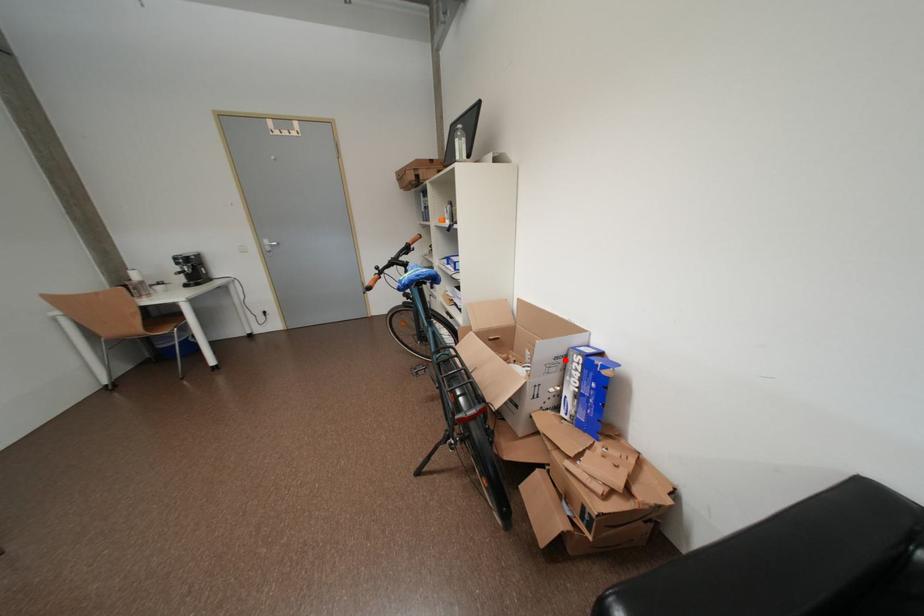
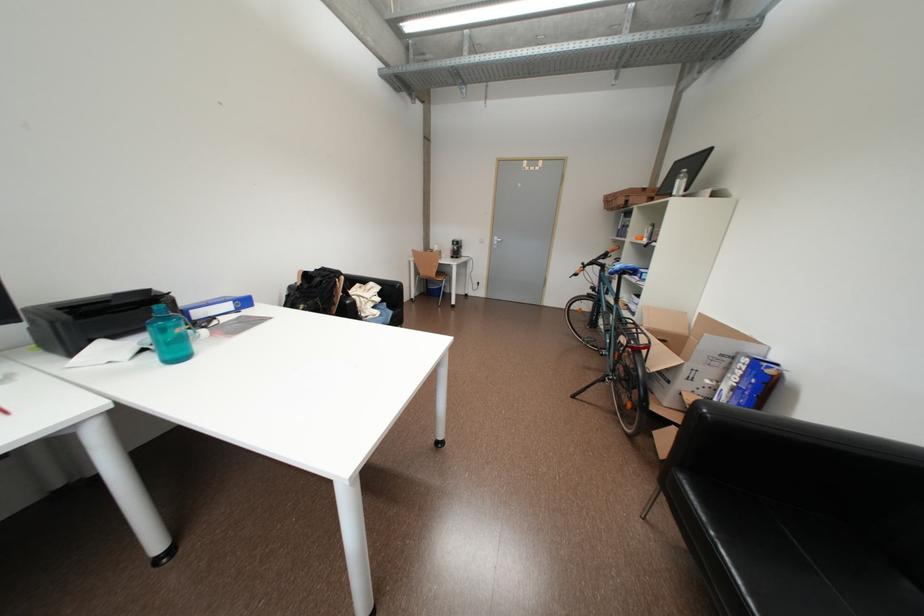
Locate, in the second image, the point that corresponds to the highlighted location in the first image.

(731, 358)